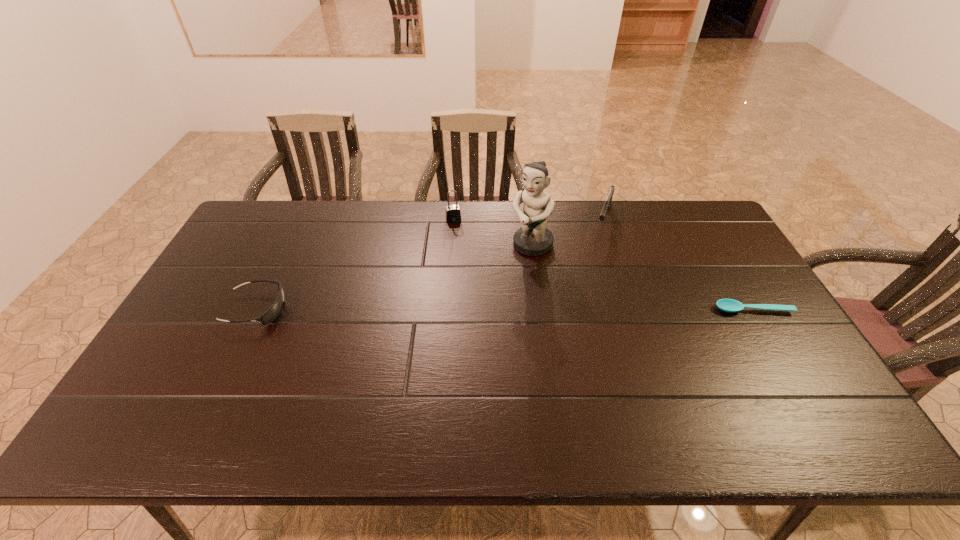
At what (x,y) coordinates should I click in order to perform the action: click on free spot between the second object from right to left and the leftmost object. Please return your answer as a coordinate pair (x, y). The height and width of the screenshot is (540, 960). Looking at the image, I should click on (430, 263).

Where is `object that ranks as the second closest to the fourth object from right to left`? The width and height of the screenshot is (960, 540). object that ranks as the second closest to the fourth object from right to left is located at coordinates coord(607,203).

The image size is (960, 540). In order to click on the second closest object to the spoon in this screenshot , I will do `click(533, 238)`.

At what (x,y) coordinates should I click in order to perform the action: click on vacant position in the image that satisfies the following two spatial constraints: 1. on the back side of the fourth object from right to left; 2. on the right side of the second object from right to left. Please return your answer as a coordinate pair (x, y). This screenshot has height=540, width=960. Looking at the image, I should click on (453, 217).

This screenshot has width=960, height=540. What are the coordinates of `vacant space that satisfies the following two spatial constraints: 1. on the front side of the third object from right to left; 2. on the left side of the shortest object` in the screenshot? It's located at (540, 309).